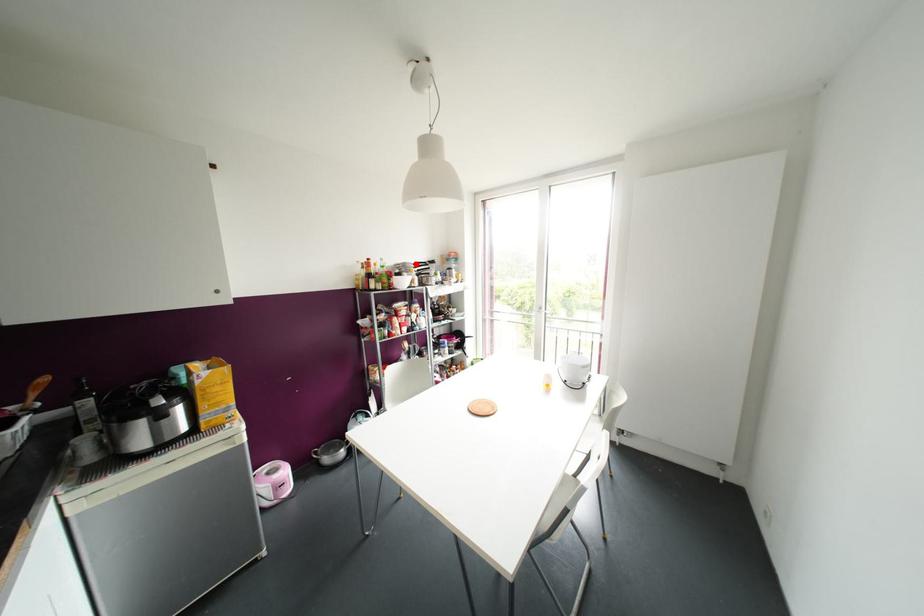
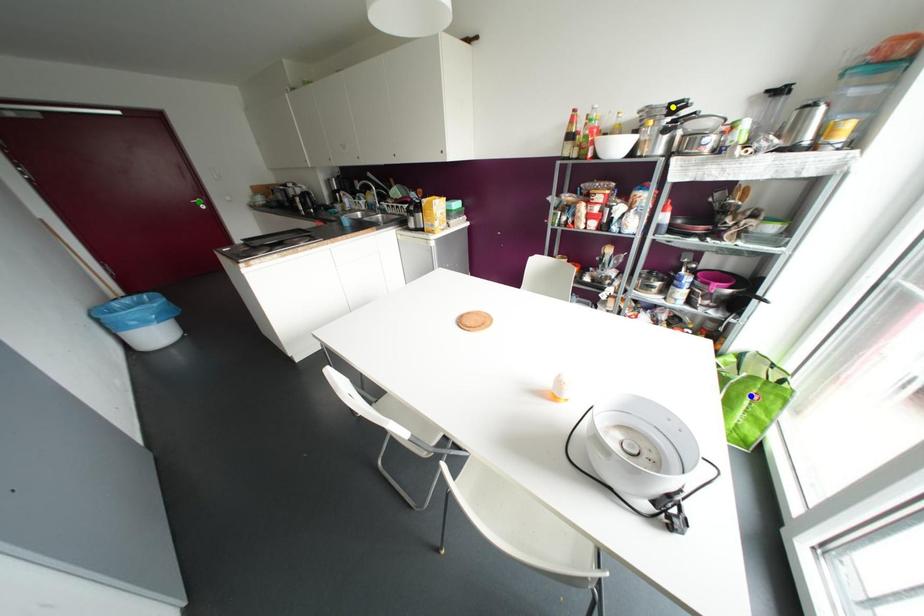
Question: I am providing you with two images of the same scene from different viewpoints. A red point is marked on the first image. You are given multiple points on the second image. In image 2, which mark is for the same physical point as the one in image 1?

Choices:
 (A) green point
 (B) blue point
 (C) yellow point

Answer: (C)